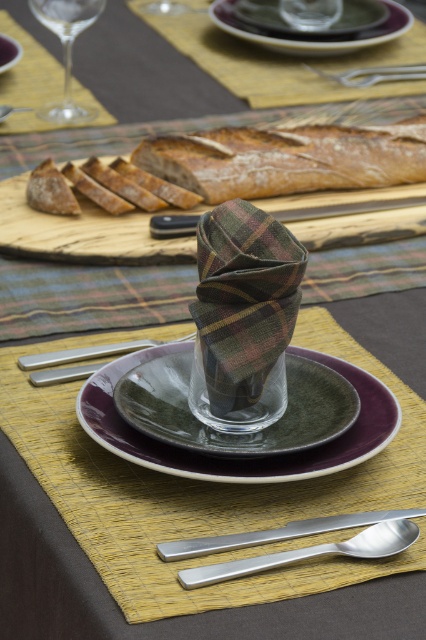
You are a guest at this table and want to pick up the silver metallic fork at center and the silver metallic fork at upper center. Which fork should you reach for first to pick up the one closer to you?

You should reach for the silver metallic fork at center first because it is closer to you than the silver metallic fork at upper center.

You are sitting at the table and want to reach both the point at coordinates (71, 356) and the point at coordinates (403, 67). Which point is closer to you?

The point at coordinates (71, 356) is closer to you because it is in front of the point at coordinates (403, 67).